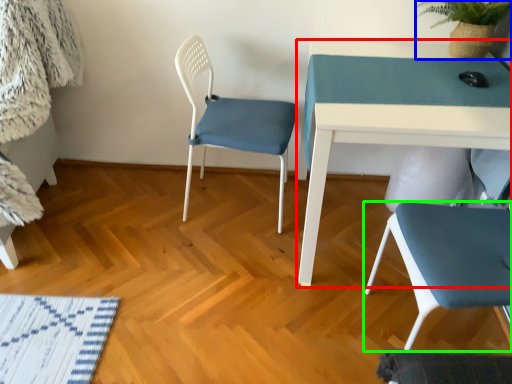
Question: Considering the real-world distances, which object is farthest from table (highlighted by a red box)? plant (highlighted by a blue box) or chair (highlighted by a green box)?

Choices:
 (A) plant
 (B) chair

Answer: (A)